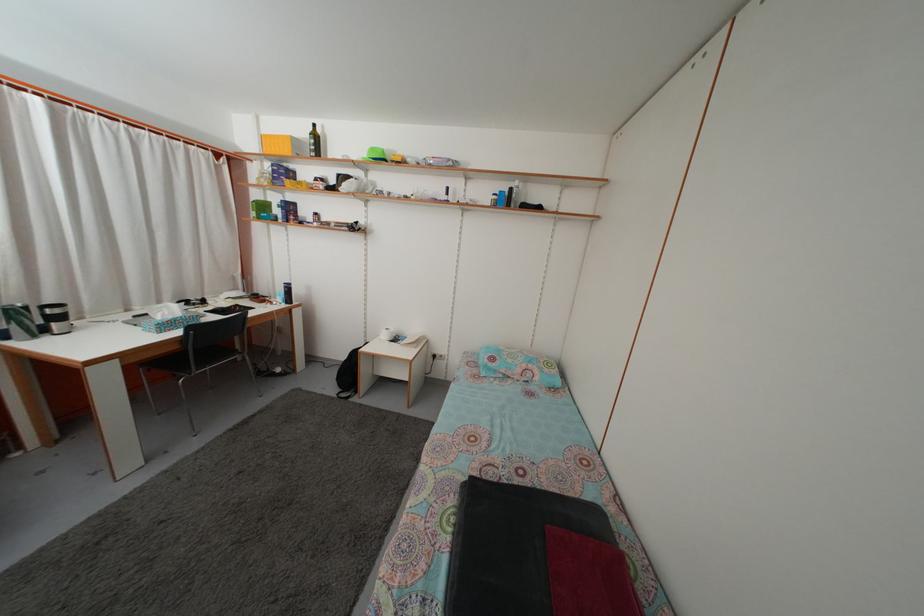
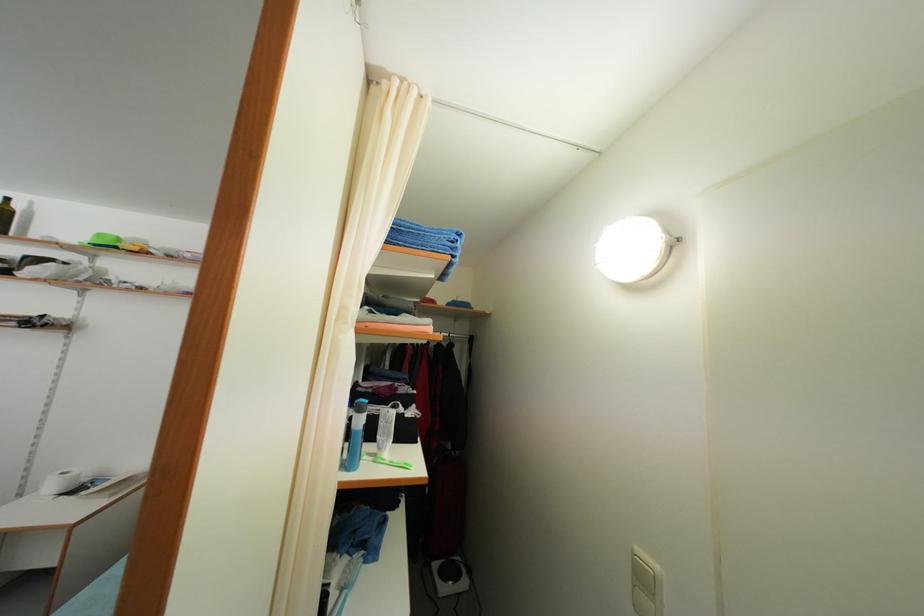
Question: I am providing you with two images of the same scene from different viewpoints. After the viewpoint changes to image2, which objects are now occluded?

Choices:
 (A) green bowl
 (B) clear plastic container
 (C) toilet paper roll
 (D) none of these

Answer: (D)